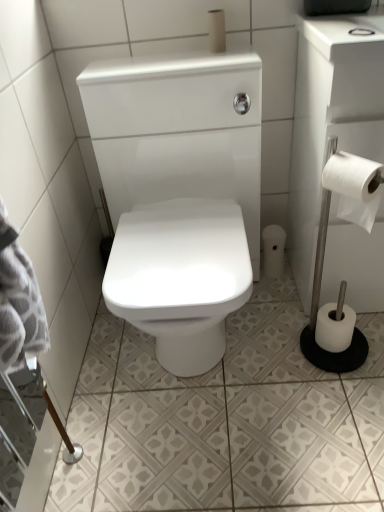
Question: Is white matte toilet paper at upper center, marked as the 3th toilet paper in a back-to-front arrangement, to the left of white paper at right, positioned as the fourth toilet paper in back-to-front order, from the viewer's perspective?

Choices:
 (A) yes
 (B) no

Answer: (A)

Question: Is white matte toilet paper at upper center, which is counted as the first toilet paper, starting from the left, facing away from white paper at right, acting as the 2th toilet paper starting from the top?

Choices:
 (A) yes
 (B) no

Answer: (B)

Question: Is white matte toilet paper at upper center, the 2th toilet paper from the front, to the right of white paper at right, which ranks as the 1th toilet paper in front-to-back order, from the viewer's perspective?

Choices:
 (A) yes
 (B) no

Answer: (B)

Question: Could you tell me if white matte toilet paper at upper center, the 1th toilet paper from the top, is turned towards white paper at right, the 3th toilet paper in the left-to-right sequence?

Choices:
 (A) no
 (B) yes

Answer: (A)

Question: Choose the correct answer: Is white paper at right, the third toilet paper ordered from the bottom, inside white paper roll at lower right, which is counted as the second toilet paper, starting from the bottom, or outside it?

Choices:
 (A) outside
 (B) inside

Answer: (A)

Question: From a real-world perspective, relative to white paper roll at lower right, the fourth toilet paper when ordered from front to back, is white paper at right, the third toilet paper ordered from the bottom, vertically above or below?

Choices:
 (A) below
 (B) above

Answer: (B)

Question: Based on their sizes in the image, would you say white paper at right, the third toilet paper ordered from the bottom, is bigger or smaller than white paper roll at lower right, the fourth toilet paper when ordered from front to back?

Choices:
 (A) big
 (B) small

Answer: (A)

Question: Based on their positions, is white paper at right, the third toilet paper ordered from the bottom, located to the left or right of white paper roll at lower right, the 1th toilet paper viewed from the back?

Choices:
 (A) right
 (B) left

Answer: (A)

Question: In the image, is white glossy ceramic tile at center positioned in front of or behind white matte toilet paper at upper center, marked as the 3th toilet paper in a back-to-front arrangement?

Choices:
 (A) front
 (B) behind

Answer: (A)

Question: From a real-world perspective, is white glossy ceramic tile at center positioned above or below white matte toilet paper at upper center, marked as the 3th toilet paper in a back-to-front arrangement?

Choices:
 (A) below
 (B) above

Answer: (A)

Question: In terms of height, does white glossy ceramic tile at center look taller or shorter compared to white matte toilet paper at upper center, marked as the 3th toilet paper in a back-to-front arrangement?

Choices:
 (A) tall
 (B) short

Answer: (B)

Question: Based on their sizes in the image, would you say white glossy ceramic tile at center is bigger or smaller than white matte toilet paper at upper center, placed as the 4th toilet paper when sorted from bottom to top?

Choices:
 (A) big
 (B) small

Answer: (A)

Question: From a real-world perspective, is white paper roll at lower right, which is counted as the second toilet paper, starting from the bottom, physically located above or below white glossy ceramic tile at center?

Choices:
 (A) below
 (B) above

Answer: (B)

Question: Does point (278, 227) appear closer or farther from the camera than point (334, 451)?

Choices:
 (A) farther
 (B) closer

Answer: (A)